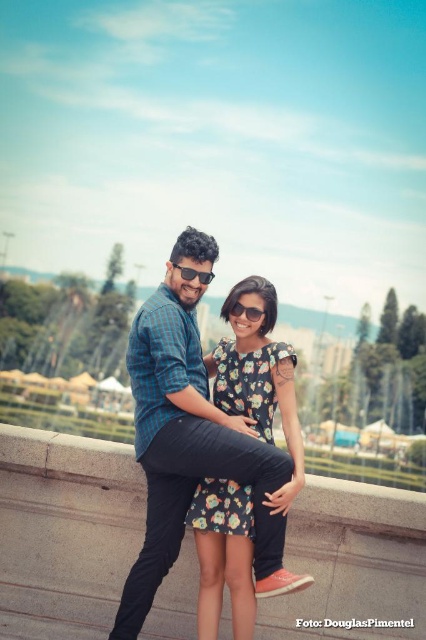
Who is lower down, floral-patterned fabric dress at center or sunglasses at center?

floral-patterned fabric dress at center is below.

Is floral-patterned fabric dress at center further to the viewer compared to sunglasses at center?

No.

You are a GUI agent. You are given a task and a screenshot of the screen. Output one action in this format:
    pyautogui.click(x=<x>, y=<y>)
    Task: Click on the floral-patterned fabric dress at center
    The height and width of the screenshot is (640, 426).
    Given the screenshot: What is the action you would take?
    pyautogui.click(x=258, y=369)

Is sunglasses at center positioned at the back of black plastic sunglasses at upper center?

No, it is in front of black plastic sunglasses at upper center.

Is point (235, 307) in front of point (190, 280)?

No, (235, 307) is further to viewer.

This screenshot has height=640, width=426. Identify the location of sunglasses at center. (247, 310).

Who is lower down, floral-patterned fabric dress at center or black plastic sunglasses at upper center?

Positioned lower is floral-patterned fabric dress at center.

Measure the distance between floral-patterned fabric dress at center and camera.

floral-patterned fabric dress at center and camera are 6.30 meters apart.

You are a GUI agent. You are given a task and a screenshot of the screen. Output one action in this format:
    pyautogui.click(x=<x>, y=<y>)
    Task: Click on the floral-patterned fabric dress at center
    The image size is (426, 640).
    Given the screenshot: What is the action you would take?
    pyautogui.click(x=258, y=369)